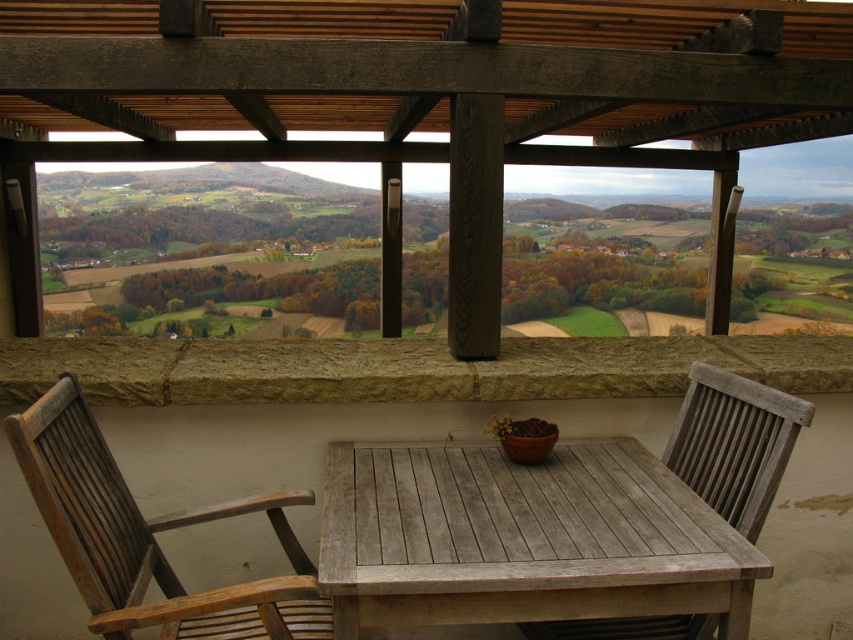
Question: Is wooden chair at lower left below weathered wood chair at center?

Choices:
 (A) no
 (B) yes

Answer: (B)

Question: Which of the following is the farthest from the observer?

Choices:
 (A) (579, 464)
 (B) (714, 385)

Answer: (B)

Question: Which point is closer to the camera?

Choices:
 (A) wooden chair at lower left
 (B) weathered wood table at center

Answer: (B)

Question: Can you confirm if weathered wood table at center is positioned above weathered wood chair at center?

Choices:
 (A) yes
 (B) no

Answer: (B)

Question: Considering the relative positions of weathered wood table at center and wooden chair at lower left in the image provided, where is weathered wood table at center located with respect to wooden chair at lower left?

Choices:
 (A) above
 (B) below

Answer: (B)

Question: Which of the following is the farthest from the observer?

Choices:
 (A) (282, 634)
 (B) (642, 630)
 (C) (525, 509)

Answer: (B)